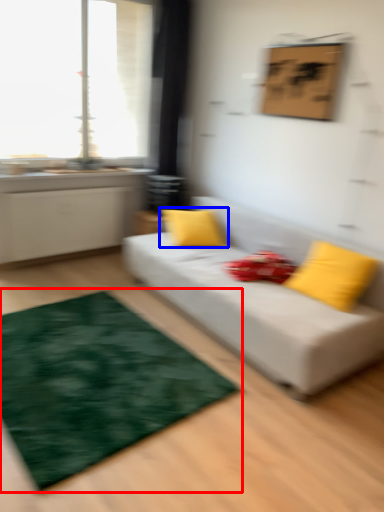
Question: Which object is closer to the camera taking this photo, mat (highlighted by a red box) or pillow (highlighted by a blue box)?

Choices:
 (A) mat
 (B) pillow

Answer: (A)